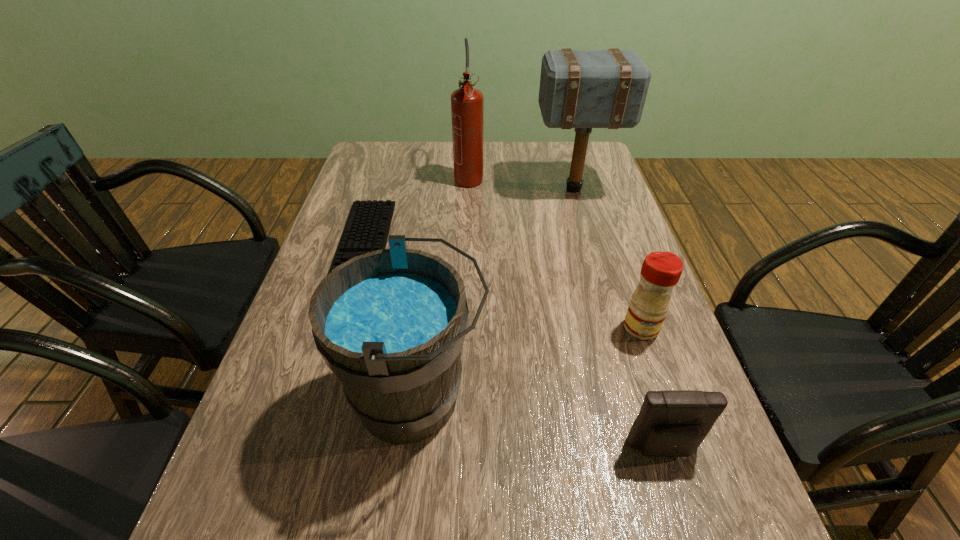
At what (x,y) coordinates should I click in order to perform the action: click on fire extinguisher. Please return your answer as a coordinate pair (x, y). The image size is (960, 540). Looking at the image, I should click on (467, 103).

Locate an element on the screen. mallet is located at coordinates (583, 89).

You are a GUI agent. You are given a task and a screenshot of the screen. Output one action in this format:
    pyautogui.click(x=<x>, y=<y>)
    Task: Click on the wine bucket
    The image size is (960, 540).
    Given the screenshot: What is the action you would take?
    pyautogui.click(x=390, y=324)

This screenshot has width=960, height=540. Identify the location of the fourth farthest object. (661, 271).

At what (x,y) coordinates should I click in order to perform the action: click on condiment. Please return your answer as a coordinate pair (x, y). Looking at the image, I should click on pyautogui.click(x=661, y=271).

Locate an element on the screen. The image size is (960, 540). pouch is located at coordinates (671, 423).

Locate an element on the screen. computer keyboard is located at coordinates (367, 228).

The image size is (960, 540). I want to click on the fourth nearest object, so click(x=367, y=228).

Where is `blank space located 0.130m from the nozzle of the fire extinguisher`? blank space located 0.130m from the nozzle of the fire extinguisher is located at coordinates (468, 216).

Where is `vacant space located 0.200m on the striking surface of the mallet`? vacant space located 0.200m on the striking surface of the mallet is located at coordinates (469, 189).